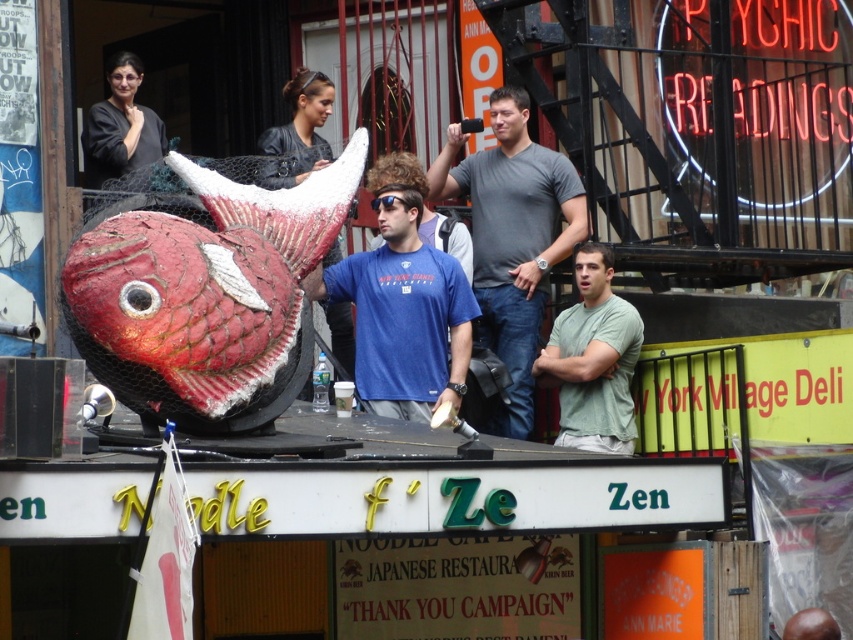
Which is in front, point (96, 252) or point (489, 237)?

Positioned in front is point (96, 252).

Between matte papier-mâché fish at center and gray cotton t-shirt at center, which one appears on the right side from the viewer's perspective?

From the viewer's perspective, gray cotton t-shirt at center appears more on the right side.

Image resolution: width=853 pixels, height=640 pixels. Identify the location of matte papier-mâché fish at center. (202, 288).

Which is below, gray cotton t-shirt at center or black plastic goggles at center?

gray cotton t-shirt at center is lower down.

The width and height of the screenshot is (853, 640). What do you see at coordinates (512, 236) in the screenshot?
I see `gray cotton t-shirt at center` at bounding box center [512, 236].

The height and width of the screenshot is (640, 853). What are the coordinates of `gray cotton t-shirt at center` in the screenshot? It's located at (512, 236).

Find the location of a particular element. This screenshot has height=640, width=853. gray cotton t-shirt at center is located at coordinates (512, 236).

Between gray cotton t-shirt at center and green matte shirt at center, which one is positioned higher?

Positioned higher is gray cotton t-shirt at center.

Looking at this image, does gray cotton t-shirt at center appear on the right side of green matte shirt at center?

Incorrect, gray cotton t-shirt at center is not on the right side of green matte shirt at center.

Is point (498, 212) closer to viewer compared to point (612, 428)?

No.

At what (x,y) coordinates should I click in order to perform the action: click on gray cotton t-shirt at center. Please return your answer as a coordinate pair (x, y). Looking at the image, I should click on 512,236.